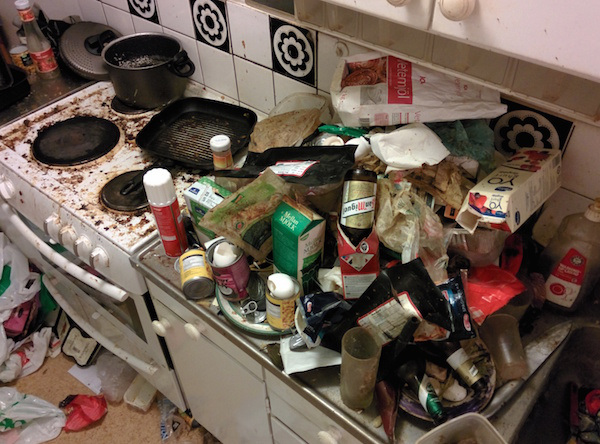
Where is `stove`? The width and height of the screenshot is (600, 444). stove is located at coordinates (123, 231).